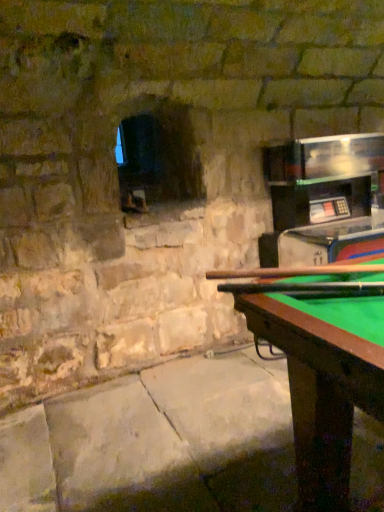
The height and width of the screenshot is (512, 384). In order to click on wooden smooth cue at center in this screenshot , I will do `click(304, 287)`.

Describe the element at coordinates (304, 287) in the screenshot. I see `wooden smooth cue at center` at that location.

Where is `wooden smooth cue at center`? Image resolution: width=384 pixels, height=512 pixels. wooden smooth cue at center is located at coordinates (304, 287).